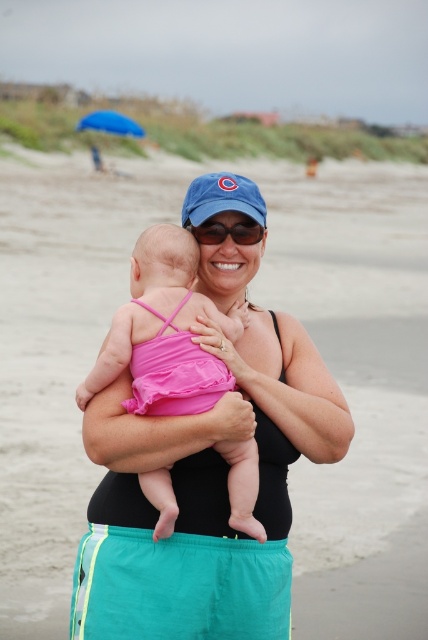
Question: Which object is positioned farthest from the matte black swimsuit at center?

Choices:
 (A) sunglasses at center
 (B) black matte arm at center
 (C) pink fabric baby at center
 (D) blue fabric umbrella at upper left

Answer: (D)

Question: Which point is farther to the camera?

Choices:
 (A) (308, 387)
 (B) (133, 120)
 (C) (196, 202)

Answer: (B)

Question: Does matte black swimsuit at center have a lesser width compared to blue fabric umbrella at upper left?

Choices:
 (A) yes
 (B) no

Answer: (A)

Question: Does matte black swimsuit at center have a greater width compared to blue fabric umbrella at upper left?

Choices:
 (A) no
 (B) yes

Answer: (A)

Question: Can you confirm if matte black swimsuit at center is bigger than black matte arm at center?

Choices:
 (A) yes
 (B) no

Answer: (A)

Question: Which point is farther to the camera?

Choices:
 (A) sunglasses at center
 (B) blue fabric umbrella at upper left
 (C) black matte arm at center
 (D) matte black swimsuit at center

Answer: (B)